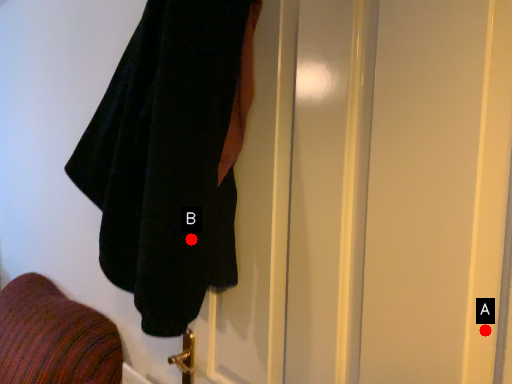
Question: Two points are circled on the image, labeled by A and B beside each circle. Among these points, which one is nearest to the camera?

Choices:
 (A) A is closer
 (B) B is closer

Answer: (A)